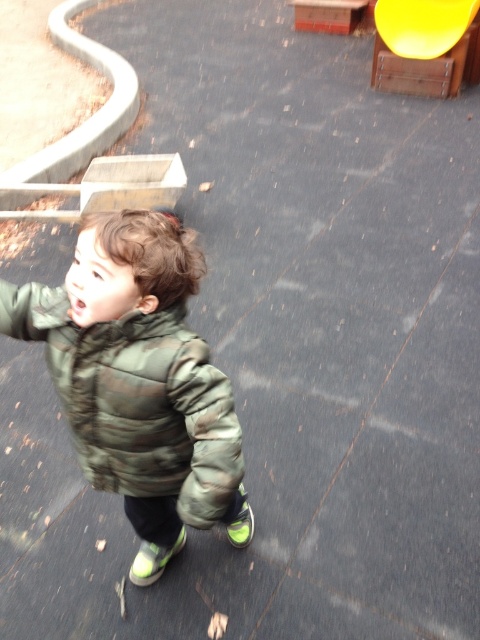
Consider the image. You are a parent trying to locate your child who is wearing a camouflage quilted jacket at center. You see the yellow plastic slide at upper right in the distance. According to the image, is the child closer to the slide or further away from it?

The camouflage quilted jacket at center is positioned under yellow plastic slide at upper right, meaning the child is closer to the slide.

You are a photographer trying to capture a shot of the camouflage quilted jacket at center and the yellow plastic slide at upper right. Since you want both objects to be clearly visible in the frame, which object should you focus on first to ensure proper framing?

The camouflage quilted jacket at center occupies less space than the yellow plastic slide at upper right, so you should focus on the camouflage quilted jacket at center first to ensure it is properly framed before adjusting for the larger slide.